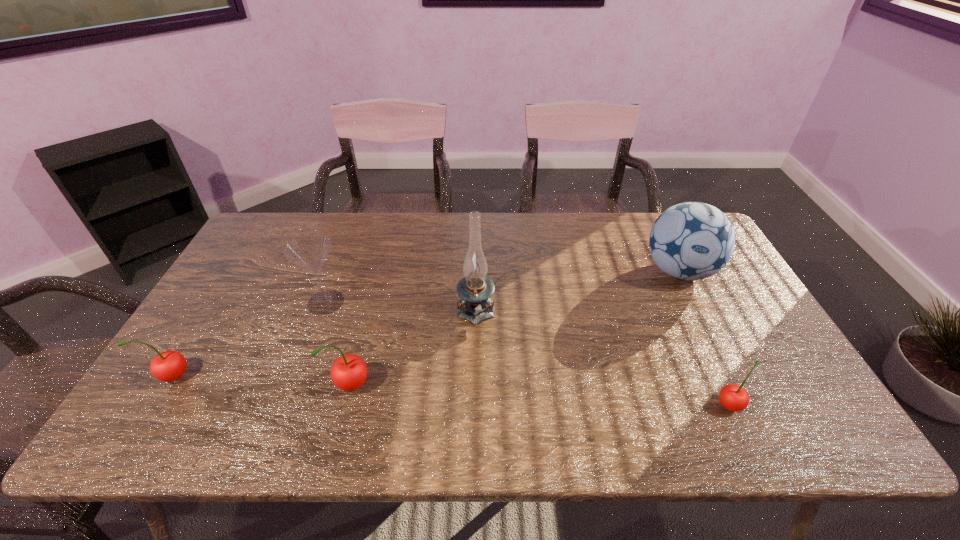
Image resolution: width=960 pixels, height=540 pixels. Identify the location of empty space between the shortest cherry and the fourth object from right to left. (540, 395).

This screenshot has width=960, height=540. Identify the location of free space between the second shortest cherry and the flute glass. [x=250, y=339].

This screenshot has width=960, height=540. I want to click on empty space that is in between the third object from right to left and the flute glass, so click(x=401, y=304).

Locate an element on the screen. Image resolution: width=960 pixels, height=540 pixels. vacant area that lies between the flute glass and the oil lamp is located at coordinates (401, 304).

At what (x,y) coordinates should I click in order to perform the action: click on object identified as the fifth closest to the flute glass. Please return your answer as a coordinate pair (x, y). The width and height of the screenshot is (960, 540). Looking at the image, I should click on (733, 397).

Point out which object is positioned as the fifth nearest to the flute glass. Please provide its 2D coordinates. Your answer should be formatted as a tuple, i.e. [(x, y)], where the tuple contains the x and y coordinates of a point satisfying the conditions above.

[(733, 397)]

Identify the location of cherry that can be found as the second closest to the oil lamp. (733, 397).

Locate which cherry is the second closest to the second tallest cherry. Please provide its 2D coordinates. Your answer should be formatted as a tuple, i.e. [(x, y)], where the tuple contains the x and y coordinates of a point satisfying the conditions above.

[(733, 397)]

Where is `vacant region that satisfies the following two spatial constraints: 1. on the front side of the rightmost cherry; 2. on the right side of the leftmost cherry`? This screenshot has width=960, height=540. vacant region that satisfies the following two spatial constraints: 1. on the front side of the rightmost cherry; 2. on the right side of the leftmost cherry is located at coordinates (155, 405).